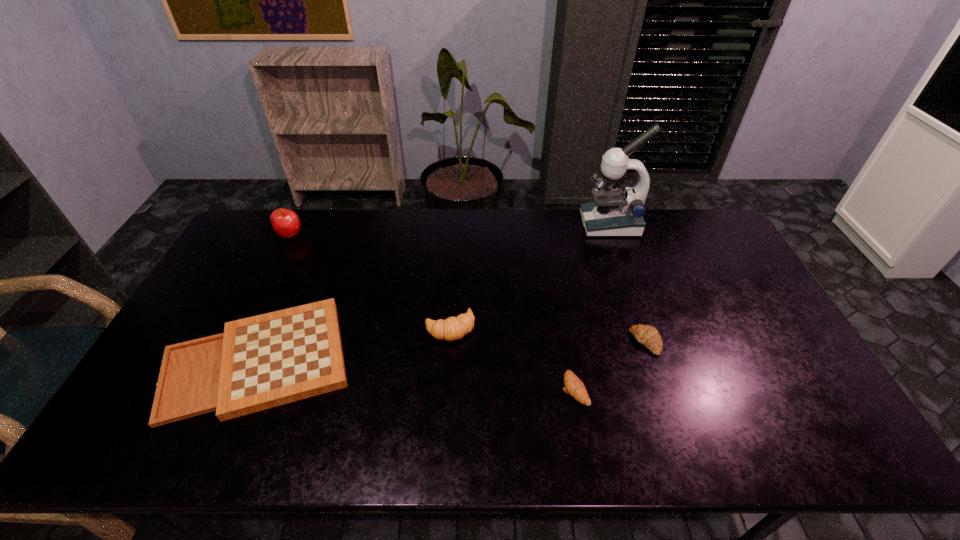
At what (x,y) coordinates should I click in order to perform the action: click on vacant space located at the eyepiece of the tallest object. Please return your answer as a coordinate pair (x, y). Looking at the image, I should click on click(x=547, y=224).

Identify the location of blank space located 0.250m at the eyepiece of the tallest object. (515, 224).

Where is `free space located on the right of the apple`? free space located on the right of the apple is located at coordinates (348, 235).

This screenshot has height=540, width=960. Identify the location of vacant area located 0.370m on the back of the fourth object from right to left. (456, 235).

Identify the location of vacant space located 0.060m on the right of the rightmost crescent roll. (682, 342).

Where is `vacant space located 0.320m on the left of the shortest crescent roll`? The width and height of the screenshot is (960, 540). vacant space located 0.320m on the left of the shortest crescent roll is located at coordinates (438, 389).

Image resolution: width=960 pixels, height=540 pixels. I want to click on vacant region located 0.250m on the back of the gameboard, so click(x=306, y=252).

Find the location of a particular element. The width and height of the screenshot is (960, 540). microscope that is at the far edge is located at coordinates (613, 213).

Locate an element on the screen. The height and width of the screenshot is (540, 960). apple that is positioned at the far edge is located at coordinates (286, 223).

Locate an element on the screen. object at the near edge is located at coordinates (260, 362).